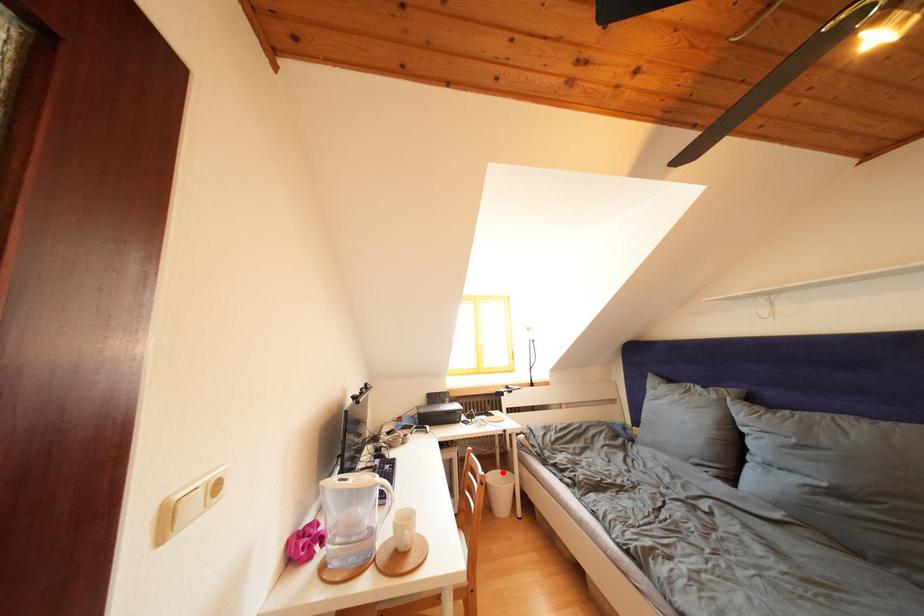
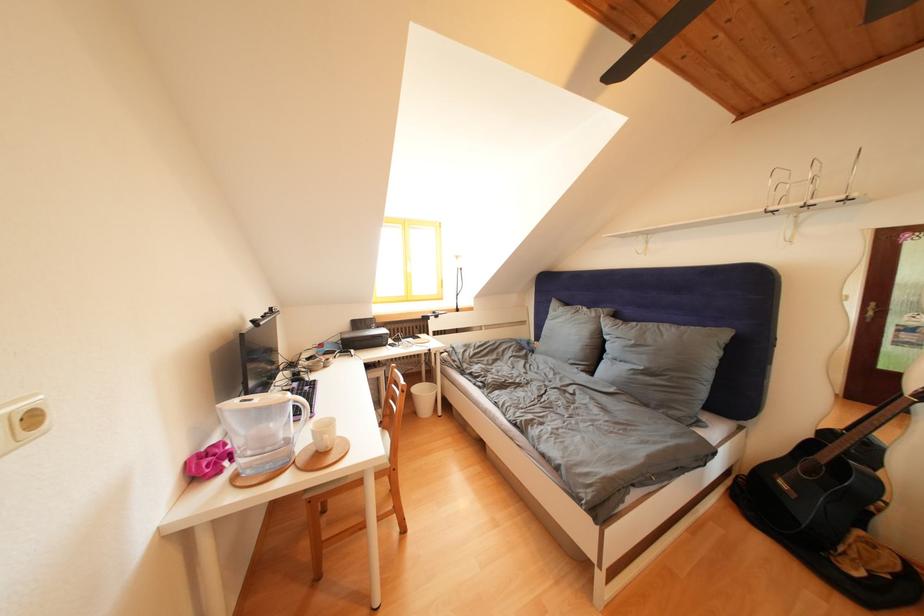
Where in the second image is the point corresponding to the highlighted location from the first image?

(429, 387)